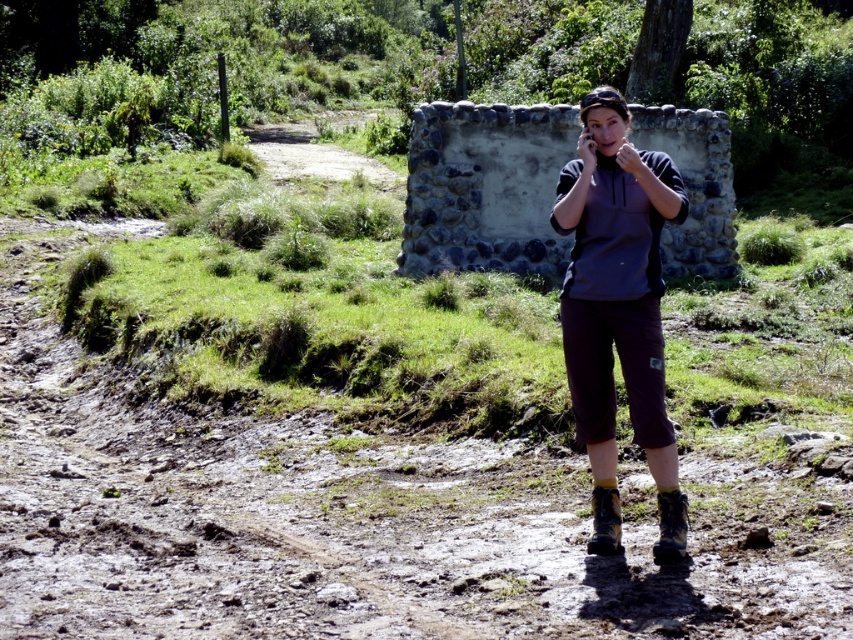
Does dusty brown dirt track at lower left appear under leather boot at lower center?

No.

Is dusty brown dirt track at lower left to the left of leather boot at lower center from the viewer's perspective?

Yes, dusty brown dirt track at lower left is to the left of leather boot at lower center.

Where is `dusty brown dirt track at lower left`? Image resolution: width=853 pixels, height=640 pixels. dusty brown dirt track at lower left is located at coordinates (224, 513).

Between point (167, 621) and point (604, 496), which one is positioned in front?

Point (167, 621) is in front.

The image size is (853, 640). Identify the location of dusty brown dirt track at lower left. (224, 513).

Image resolution: width=853 pixels, height=640 pixels. Find the location of `dusty brown dirt track at lower left`. dusty brown dirt track at lower left is located at coordinates (224, 513).

Is leather boot at lower center shorter than black suede boot at lower center?

In fact, leather boot at lower center may be taller than black suede boot at lower center.

Does leather boot at lower center have a lesser width compared to black suede boot at lower center?

In fact, leather boot at lower center might be wider than black suede boot at lower center.

Find the location of `leather boot at lower center`. leather boot at lower center is located at coordinates (671, 525).